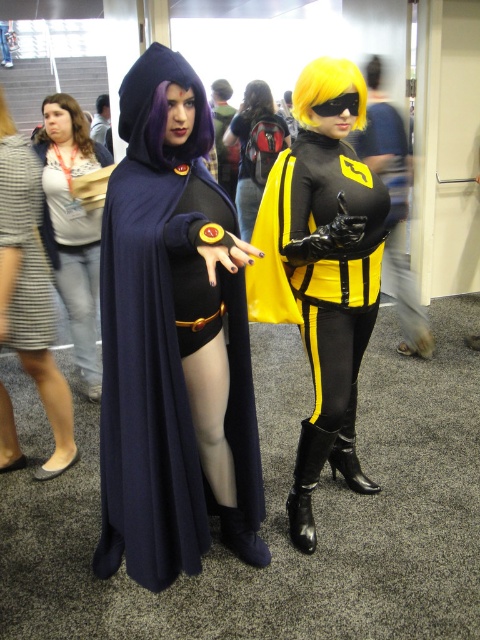
You are a photographer at a cosplay event. You need to take a portrait of the two cosplayers. The yellow matte mask at center and the golden synthetic wig at upper right are both important elements. Which object should you focus on first if you want to ensure both are in frame without cropping?

Since the yellow matte mask at center is wider than the golden synthetic wig at upper right, you should focus on the yellow matte mask at center first to ensure both fit within the frame.

You are a photographer at a cosplay event. You need to capture a photo where both the yellow leather bodysuit at center and the matte gray dress at left are clearly visible. Based on their positions, which one should you focus on first to ensure both are in frame?

The yellow leather bodysuit at center is in front of the matte gray dress at left, so focusing on the yellow leather bodysuit at center first will ensure both are in frame as the matte gray dress at left is behind it.